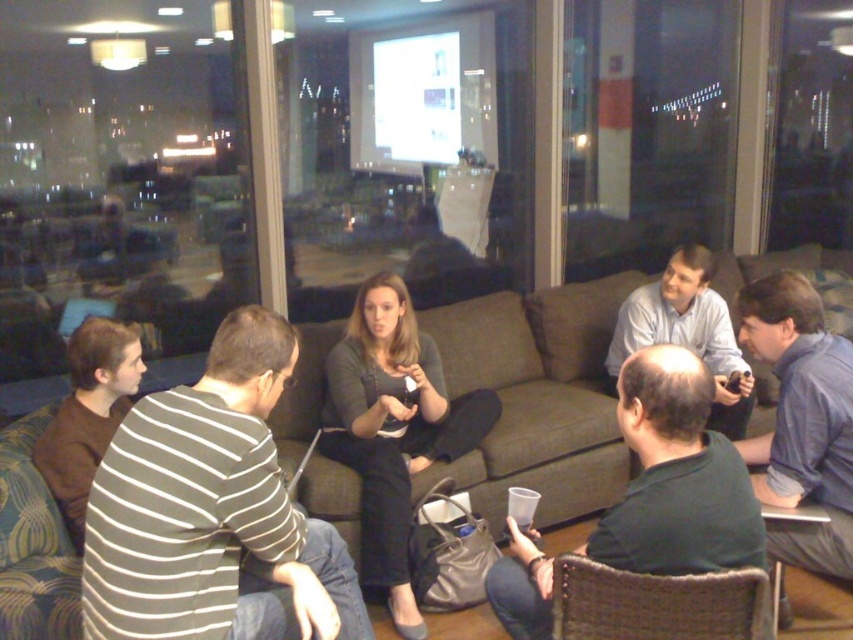
Question: Which point is closer to the camera?

Choices:
 (A) (677, 284)
 (B) (13, 488)
 (C) (361, 541)
 (D) (631, 566)

Answer: (D)

Question: Which object appears farthest from the camera in this image?

Choices:
 (A) brown cotton shirt at left
 (B) dark gray sweater at center
 (C) blue shirt at right

Answer: (B)

Question: Can you confirm if dark green t-shirt at center is positioned above blue shirt at right?

Choices:
 (A) yes
 (B) no

Answer: (B)

Question: Is dark green t-shirt at center further to camera compared to blue shirt at right?

Choices:
 (A) no
 (B) yes

Answer: (A)

Question: Which is nearer to the brown fabric couch at center?

Choices:
 (A) dark gray sweater at center
 (B) brown cotton shirt at left
 (C) striped cotton shirt at lower left
 (D) dark green t-shirt at center

Answer: (A)

Question: Is dark green t-shirt at center smaller than dark gray sweater at center?

Choices:
 (A) no
 (B) yes

Answer: (B)